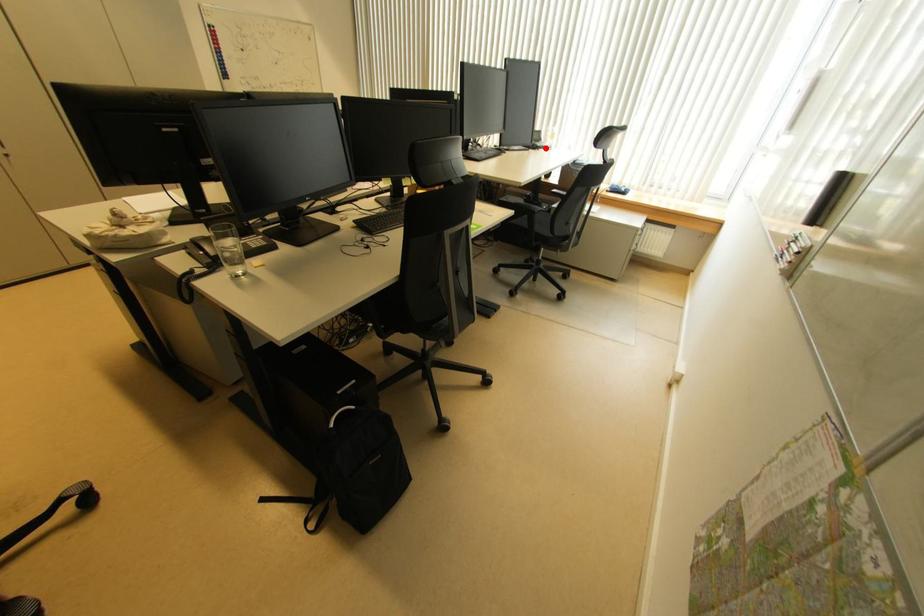
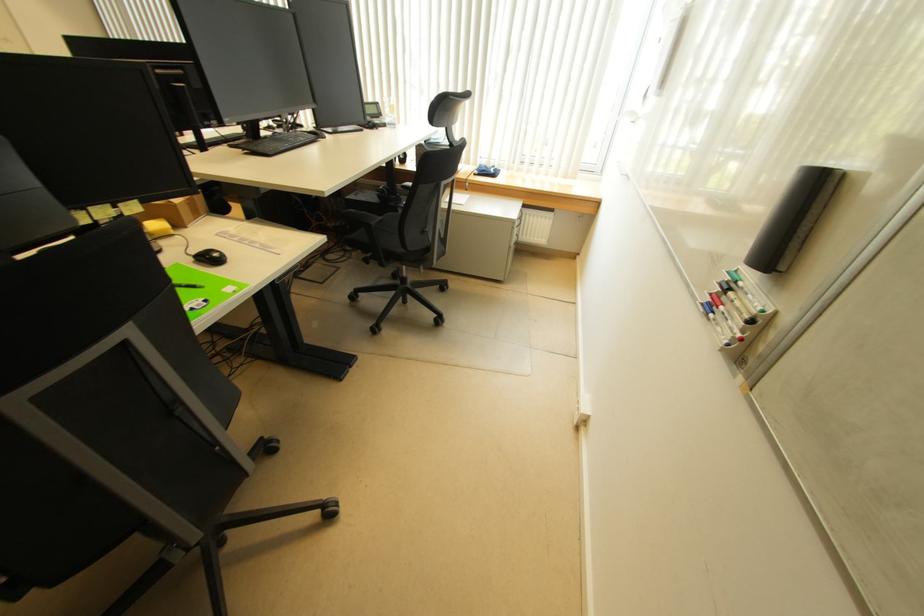
Question: I am providing you with two images of the same scene from different viewpoints. Given a red point in image1, look at the same physical point in image2. Is it:

Choices:
 (A) Closer to the viewpoint
 (B) Farther from the viewpoint

Answer: (A)